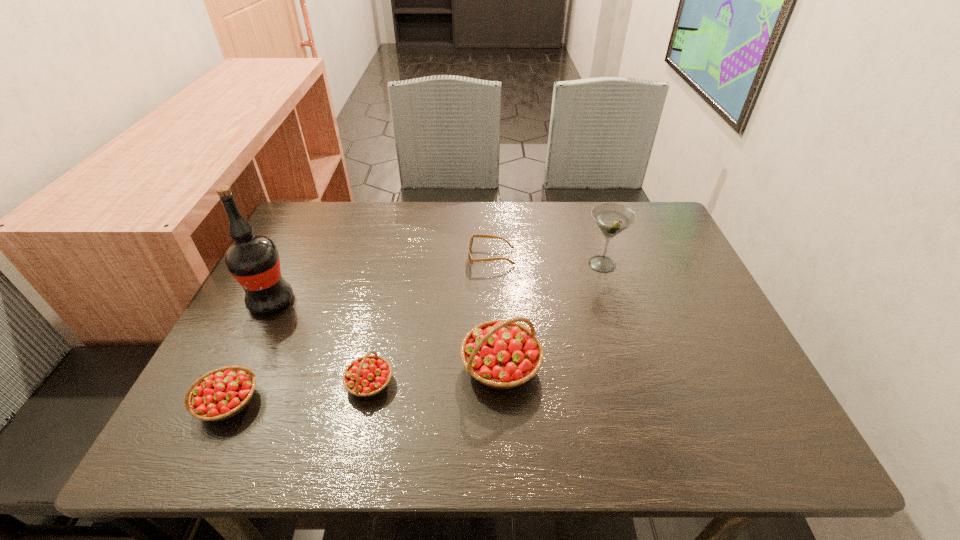
This screenshot has width=960, height=540. Identify the location of the fourth tallest object. (220, 394).

Locate an element on the screen. the second tallest strawberry is located at coordinates (220, 394).

This screenshot has width=960, height=540. In order to click on the shortest strawberry in this screenshot , I will do `click(367, 376)`.

Find the location of a particular element. the fourth object from right to left is located at coordinates (367, 376).

What are the coordinates of `the fourth shortest object` in the screenshot? It's located at (502, 354).

Identify the location of the rightmost strawberry. (502, 354).

Image resolution: width=960 pixels, height=540 pixels. I want to click on the rightmost object, so click(612, 218).

Identify the location of martini. (612, 218).

Where is `wine bottle`? The width and height of the screenshot is (960, 540). wine bottle is located at coordinates (253, 260).

Where is `the tallest object`? the tallest object is located at coordinates (253, 260).